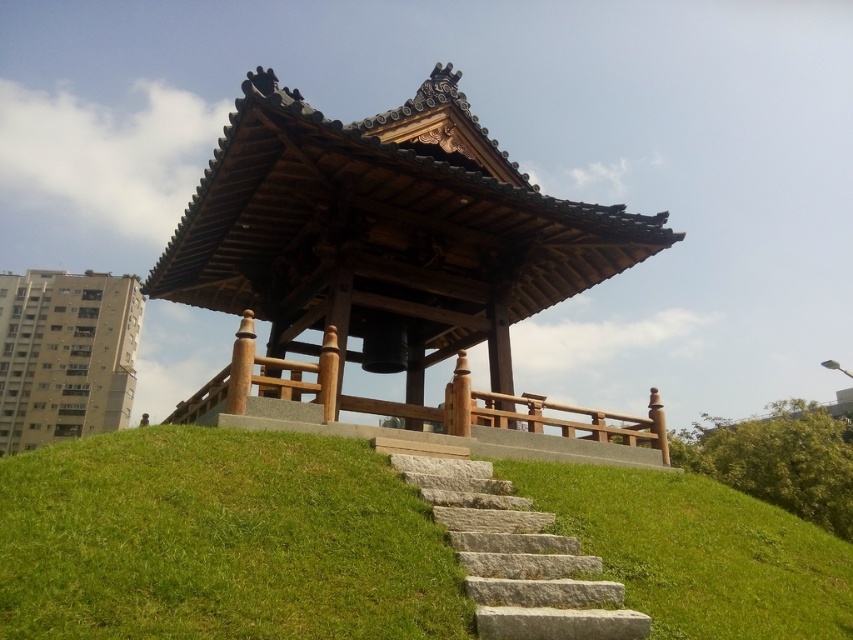
Does wooden gazebo at center have a smaller size compared to green stone stairs at center?

No.

Does point (196, 205) come behind point (764, 632)?

That is True.

Between point (500, 289) and point (837, 600), which one is positioned behind?

The point (500, 289) is more distant.

Where is `wooden gazebo at center`? The width and height of the screenshot is (853, 640). wooden gazebo at center is located at coordinates (387, 257).

Can you confirm if wooden gazebo at center is wider than gray stone stairs at center?

Yes.

Locate an element on the screen. wooden gazebo at center is located at coordinates (387, 257).

Does point (236, 163) lie behind point (492, 592)?

Yes, point (236, 163) is behind point (492, 592).

Where is `wooden gazebo at center`? The width and height of the screenshot is (853, 640). wooden gazebo at center is located at coordinates (387, 257).

Who is more forward, (347,234) or (55,484)?

Point (55,484) is more forward.

What do you see at coordinates (387, 257) in the screenshot? Image resolution: width=853 pixels, height=640 pixels. I see `wooden gazebo at center` at bounding box center [387, 257].

What are the coordinates of `wooden gazebo at center` in the screenshot? It's located at (387, 257).